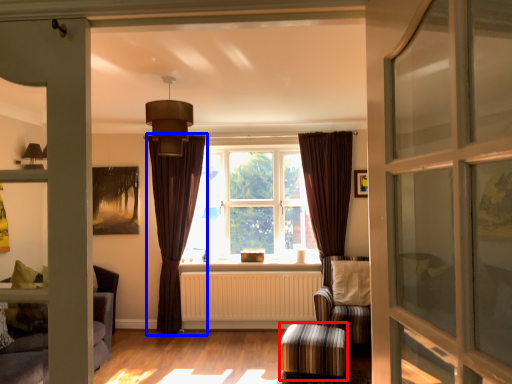
Question: Which object appears closest to the camera in this image, stool (highlighted by a red box) or curtain (highlighted by a blue box)?

Choices:
 (A) stool
 (B) curtain

Answer: (A)